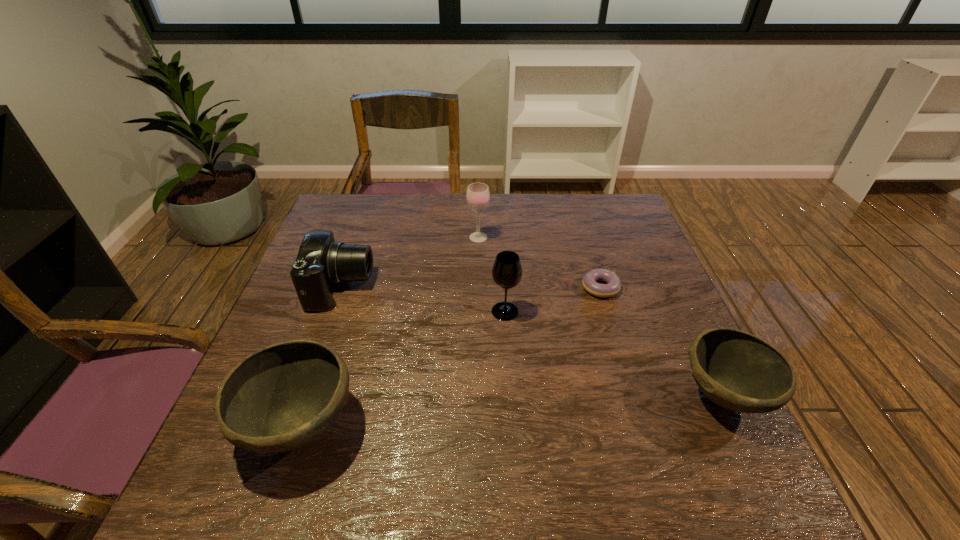
What are the coordinates of `the left bowl` in the screenshot? It's located at (281, 397).

I want to click on the shorter bowl, so click(x=736, y=370).

Identify the location of the right bowl. The image size is (960, 540). (736, 370).

Find the location of a particular element. the farther wineglass is located at coordinates (478, 195).

You are a GUI agent. You are given a task and a screenshot of the screen. Output one action in this format:
    pyautogui.click(x=<x>, y=<y>)
    Task: Click on the camera
    This screenshot has height=540, width=960.
    Given the screenshot: What is the action you would take?
    pyautogui.click(x=321, y=262)

In order to click on the nearer wineglass in this screenshot , I will do `click(507, 271)`.

Locate an element on the screen. This screenshot has width=960, height=540. the second object from right to left is located at coordinates (613, 286).

Locate an element on the screen. This screenshot has height=540, width=960. the shortest object is located at coordinates (613, 286).

At what (x,y) coordinates should I click in order to perform the action: click on vacant area situated 0.320m on the back of the left bowl. Please return your answer as a coordinate pair (x, y). The width and height of the screenshot is (960, 540). Looking at the image, I should click on (349, 279).

Find the location of a particular element. This screenshot has width=960, height=540. vacant space located on the back of the second shortest object is located at coordinates [x=658, y=260].